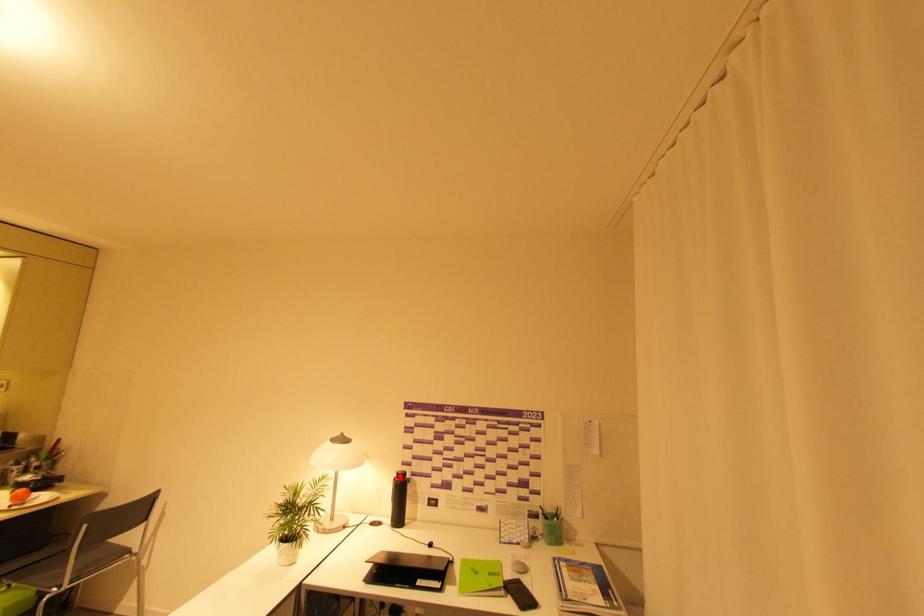
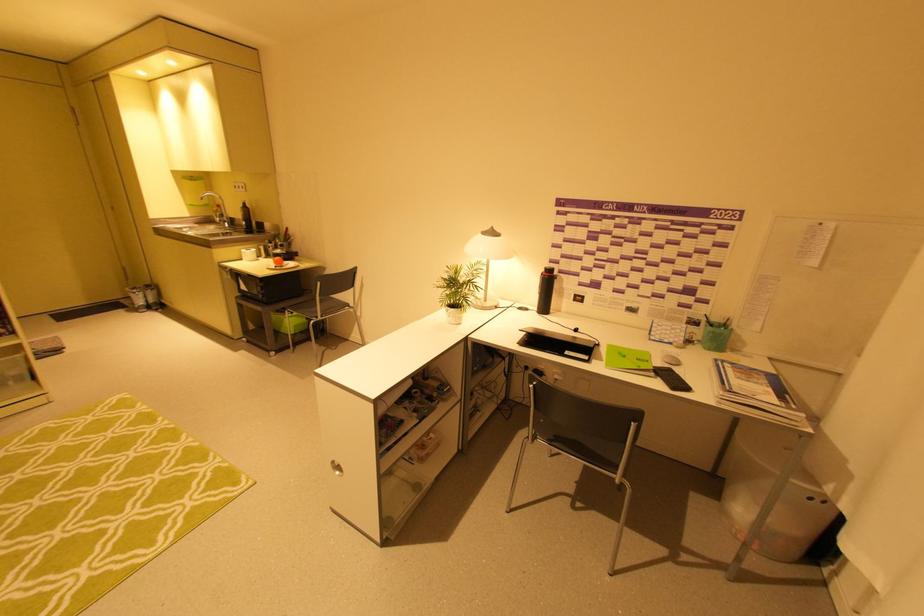
Question: I am providing you with two images of the same scene from different viewpoints. A red point is shown in image1. For the corresponding object point in image2, is it positioned nearer or farther from the camera?

Choices:
 (A) Nearer
 (B) Farther

Answer: (A)